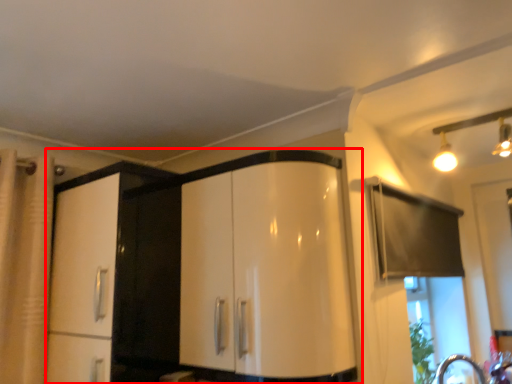
Question: From the image's perspective, where is cabinetry (annotated by the red box) located relative to light fixture?

Choices:
 (A) below
 (B) above

Answer: (A)